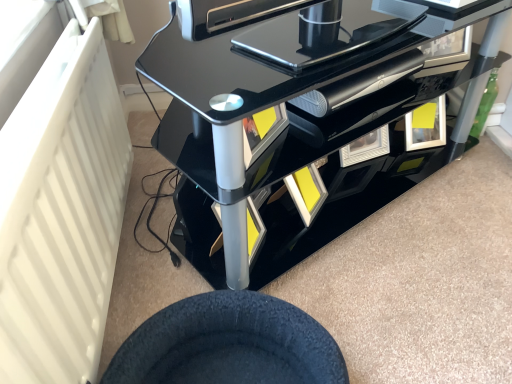
Identify the location of space that is in front of glossy black entertainment unit at center. Image resolution: width=512 pixels, height=384 pixels. (397, 287).